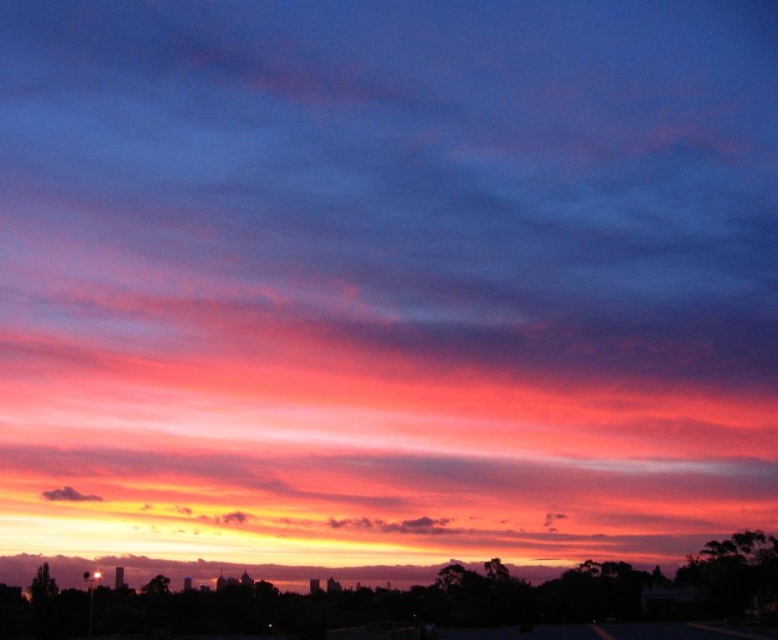
Between point (461, 588) and point (55, 499), which one is positioned behind?

The point (55, 499) is more distant.

Can you confirm if silhouette skyline at lower center is thinner than dark gray cloud at lower left?

No, silhouette skyline at lower center is not thinner than dark gray cloud at lower left.

Between point (30, 586) and point (55, 499), which one is positioned behind?

Point (55, 499)

Locate an element on the screen. Image resolution: width=778 pixels, height=640 pixels. silhouette skyline at lower center is located at coordinates (412, 598).